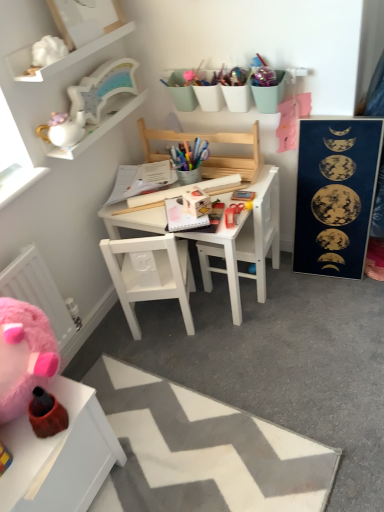
Find the location of a particular element. The height and width of the screenshot is (512, 384). vacant space that's between blue matte poster at right and white wooden table at center, arranged as the second table when ordered from the bottom is located at coordinates (293, 294).